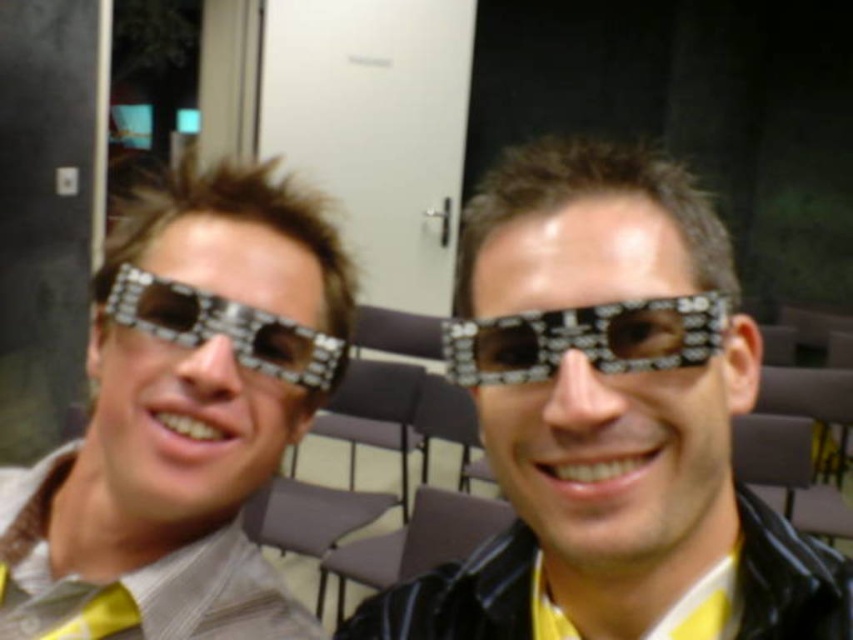
Which is below, matte black sunglasses at left or metallic reflective sunglasses at center?

matte black sunglasses at left

Is point (109, 280) positioned after point (631, 336)?

Yes, point (109, 280) is farther from viewer.

Locate an element on the screen. The image size is (853, 640). matte black sunglasses at left is located at coordinates [184, 412].

Does matte black sunglasses at center appear over black plastic goggles at left?

Incorrect, matte black sunglasses at center is not positioned above black plastic goggles at left.

Does point (621, 636) come closer to viewer compared to point (239, 358)?

That is False.

Identify the location of matte black sunglasses at center. (608, 413).

Does black plastic goggles at left appear on the left side of yellow fabric tie at lower left?

In fact, black plastic goggles at left is to the right of yellow fabric tie at lower left.

In the scene shown: Can you confirm if black plastic goggles at left is positioned above yellow fabric tie at lower left?

Yes.

This screenshot has height=640, width=853. In order to click on black plastic goggles at left in this screenshot , I will do `click(225, 328)`.